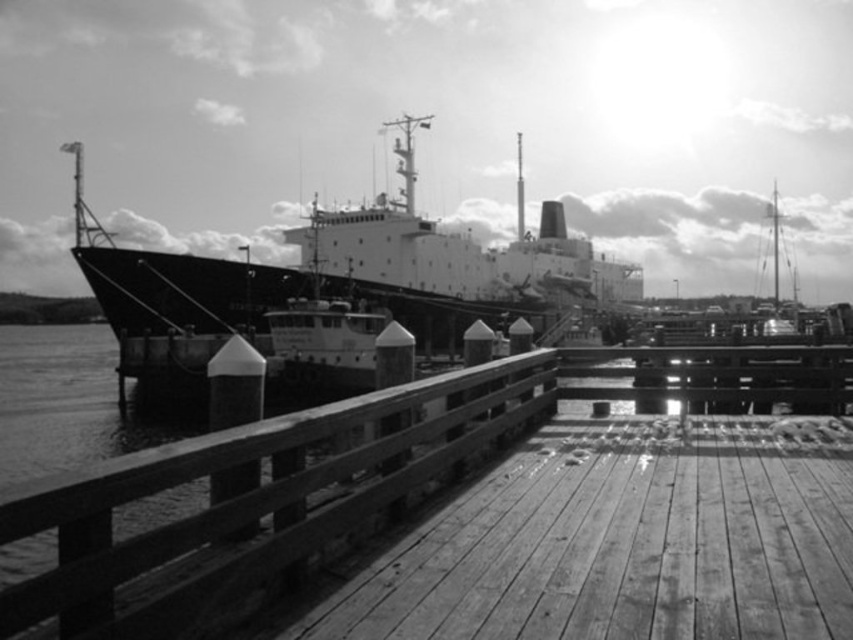
Based on the photo, you are a dock worker who needs to load cargo onto both the wooden at center and the smooth black cargo ship at center. Which one has a wider deck to accommodate larger cargo containers?

The smooth black cargo ship at center has a greater width compared to the wooden at center, so it can accommodate larger cargo containers.